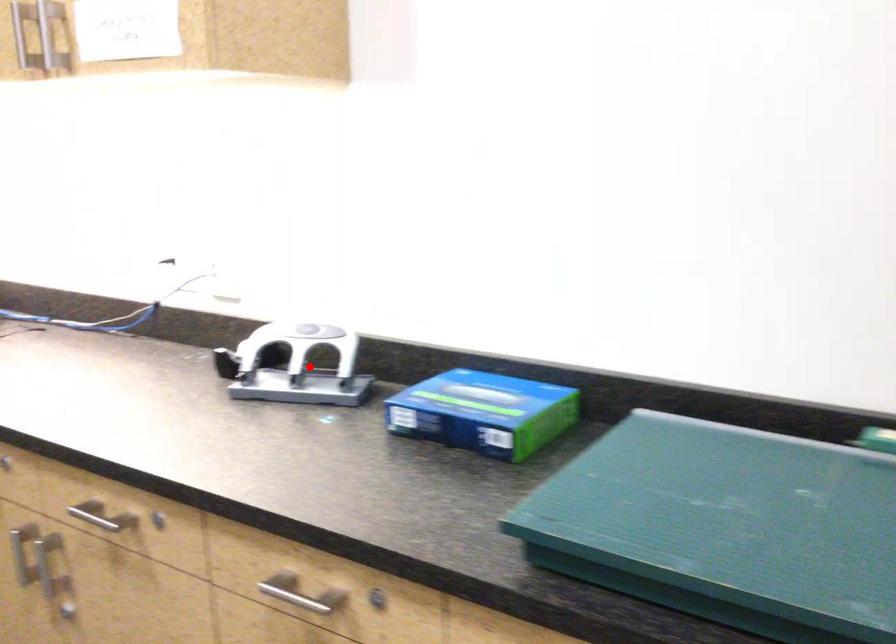
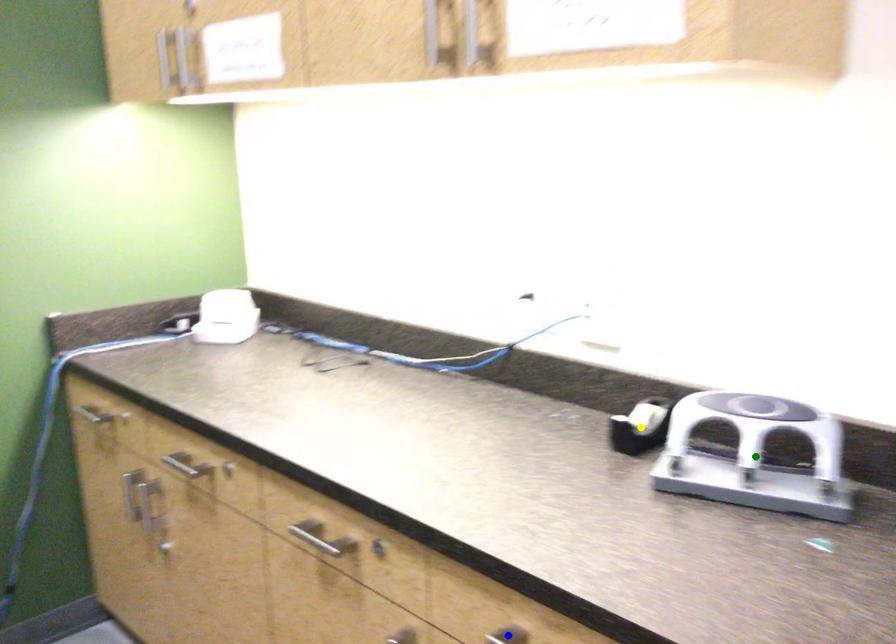
Question: I am providing you with two images of the same scene from different viewpoints. A red point is marked on the first image. You are given multiple points on the second image. Can you choose the point in image 2 that corresponds to the point in image 1?

Choices:
 (A) green point
 (B) blue point
 (C) yellow point

Answer: (A)